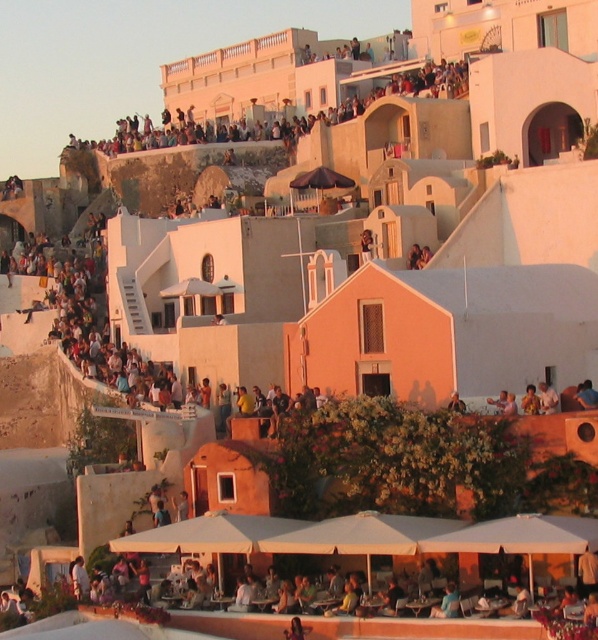
The image size is (598, 640). Describe the element at coordinates (520, 538) in the screenshot. I see `white fabric umbrella at lower center` at that location.

Can you confirm if white fabric umbrella at lower center is positioned to the left of smooth tan skin at center?

No, white fabric umbrella at lower center is not to the left of smooth tan skin at center.

Between point (483, 531) and point (451, 401), which one is positioned in front?

Point (483, 531) is more forward.

At what (x,y) coordinates should I click in order to perform the action: click on white fabric umbrella at lower center. Please return your answer as a coordinate pair (x, y). The width and height of the screenshot is (598, 640). Looking at the image, I should click on pyautogui.click(x=520, y=538).

Identify the location of matte white crowd at upper center. (385, 96).

Does matte white crowd at upper center have a smaller size compared to white fabric umbrella at lower center?

No, matte white crowd at upper center is not smaller than white fabric umbrella at lower center.

At what (x,y) coordinates should I click in order to perform the action: click on matte white crowd at upper center. Please return your answer as a coordinate pair (x, y). The image size is (598, 640). Looking at the image, I should click on (385, 96).

Measure the distance from matte white crowd at upper center to smooth tan skin at center.

A distance of 59.12 meters exists between matte white crowd at upper center and smooth tan skin at center.

Which is behind, point (329, 109) or point (451, 396)?

The point (329, 109) is more distant.

What do you see at coordinates (385, 96) in the screenshot?
I see `matte white crowd at upper center` at bounding box center [385, 96].

Identify the location of matte white crowd at upper center. This screenshot has height=640, width=598. (385, 96).